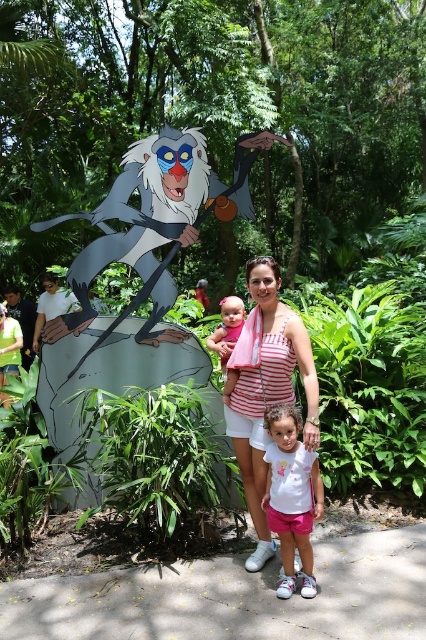
You are a photographer trying to capture a photo of the matte pink dress at center without the gray plastic figure at left blocking it. Based on their heights, can you suggest a way to position yourself to avoid the figure?

The gray plastic figure at left is much taller than the matte pink dress at center, so positioning yourself lower to the ground or moving to a side where the figure is not directly in front of the dress could help avoid the blockage caused by the taller figure.